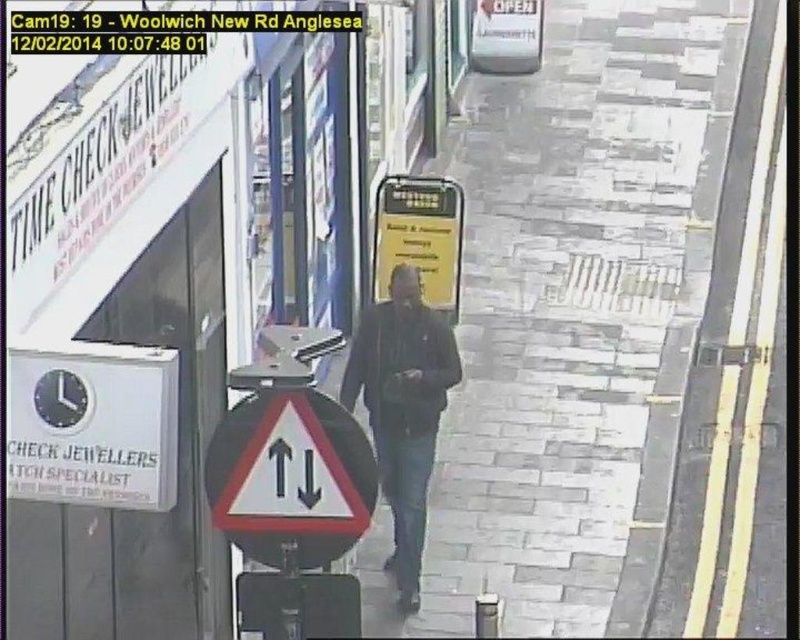
Who is taller, gray stone pavement at center or dark blue jacket at center?

gray stone pavement at center is taller.

Measure the distance between gray stone pavement at center and camera.

A distance of 12.39 meters exists between gray stone pavement at center and camera.

This screenshot has height=640, width=800. Identify the location of gray stone pavement at center. (574, 321).

Is point (392, 337) positioned after point (433, 308)?

No, it is not.

Which is in front, point (410, 404) or point (450, 312)?

Point (410, 404)

Who is more distant from viewer, (368, 380) or (414, 264)?

The point (414, 264) is more distant.

You are a GUI agent. You are given a task and a screenshot of the screen. Output one action in this format:
    pyautogui.click(x=<x>, y=<y>)
    Task: Click on the dark blue jacket at center
    This screenshot has height=640, width=800.
    Given the screenshot: What is the action you would take?
    pyautogui.click(x=402, y=410)

Is the position of gray stone pavement at center less distant than that of white plastic traffic sign at center?

No, gray stone pavement at center is behind white plastic traffic sign at center.

Can you confirm if gray stone pavement at center is taller than white plastic traffic sign at center?

Yes.

Find the location of a particular element. This screenshot has height=640, width=800. gray stone pavement at center is located at coordinates (574, 321).

The image size is (800, 640). What are the coordinates of `gray stone pavement at center` in the screenshot? It's located at coord(574,321).